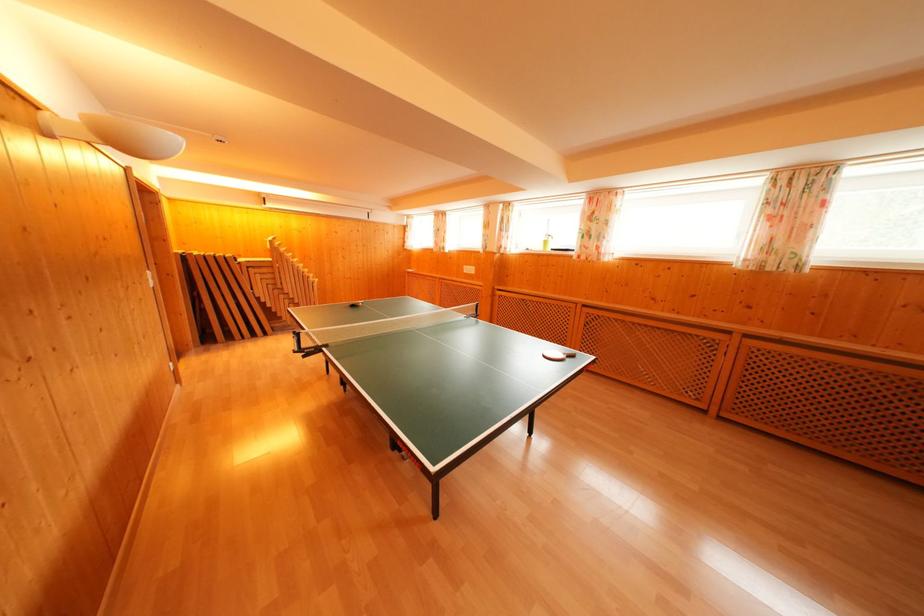
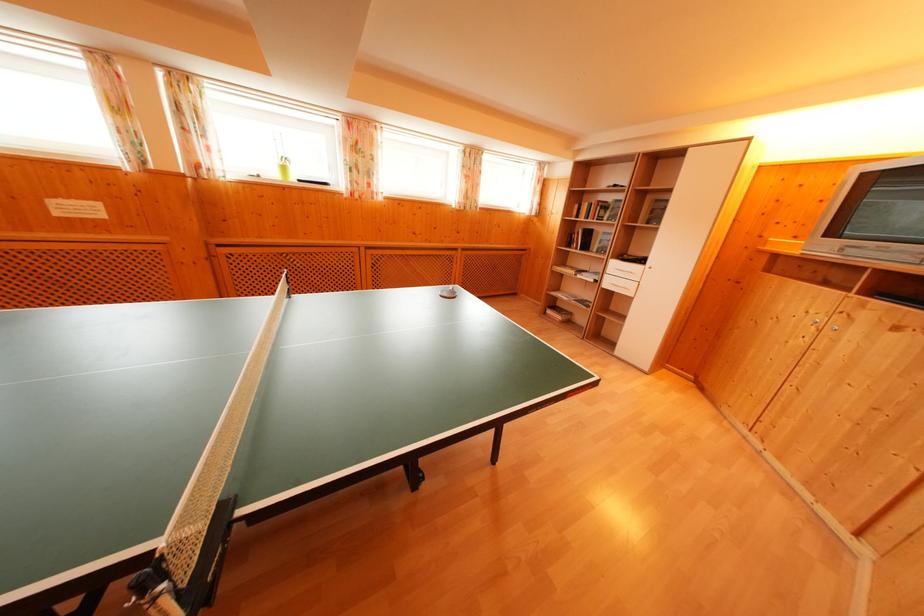
Where in the second image is the point corresponding to point 551,246 from the first image?

(288, 174)